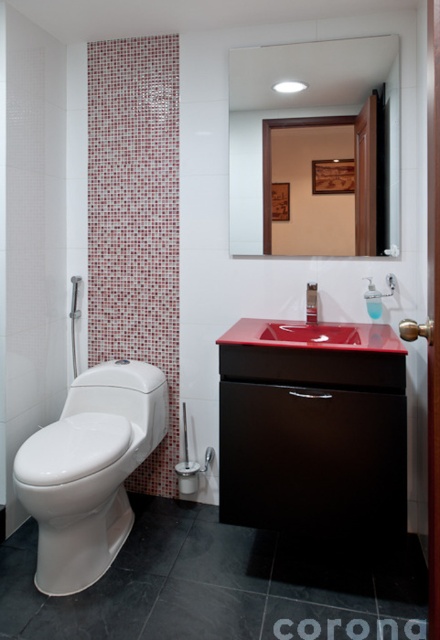
You are standing in the bathroom and want to place a small potted plant. The plant needs to be placed exactly at point (223, 552). What color is the tile at that location?

The tile at point (223, 552) is black tile at lower center.

You are standing in the bathroom and want to adjust the water temperature using the matte black faucet at sink right. To do this, you need to reach the faucet. However, there is a clear glass mirror at upper center in the way. Is the mirror positioned to your left or right relative to the faucet?

The clear glass mirror at upper center is to the left of the matte black faucet at sink right.